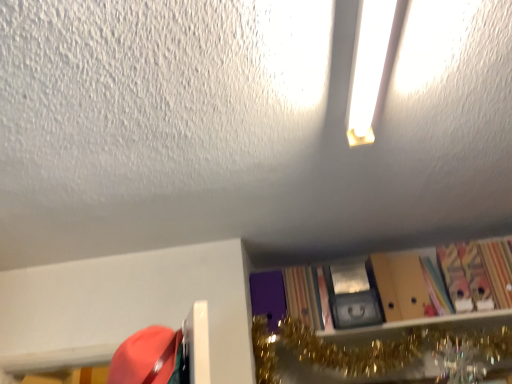
What do you see at coordinates (305, 296) in the screenshot? The width and height of the screenshot is (512, 384). I see `purple matte book at center` at bounding box center [305, 296].

Measure the distance between point (324, 321) and camera.

Point (324, 321) is 6.11 feet away from camera.

I want to click on purple matte book at center, so click(305, 296).

Measure the distance between purple matte book at center and camera.

purple matte book at center and camera are 1.84 meters apart.

Find the location of a particular element. This screenshot has width=512, height=384. purple matte book at center is located at coordinates (305, 296).